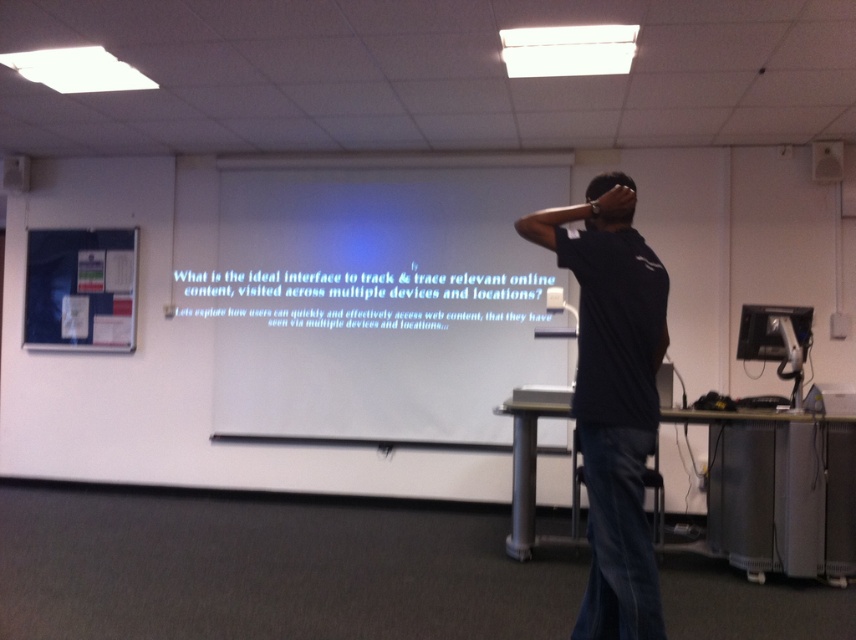
Can you confirm if black cotton shirt at center is positioned below black matte head at upper center?

Yes, black cotton shirt at center is below black matte head at upper center.

Does point (619, 280) lie in front of point (621, 216)?

Yes, point (619, 280) is in front of point (621, 216).

The height and width of the screenshot is (640, 856). Find the location of `black cotton shirt at center`. black cotton shirt at center is located at coordinates (613, 404).

Does point (96, 276) come in front of point (597, 189)?

No, it is not.

What are the coordinates of `blue fabric bulletin board at upper left` in the screenshot? It's located at point(80,289).

Is point (752, 358) positioned in front of point (592, 184)?

No, it is behind (592, 184).

Which is more to the left, matte black monitor at right or matte black hand at upper center?

Positioned to the left is matte black hand at upper center.

Is point (761, 307) positioned after point (622, 214)?

Yes, point (761, 307) is farther from viewer.

This screenshot has height=640, width=856. I want to click on matte black monitor at right, so click(x=771, y=332).